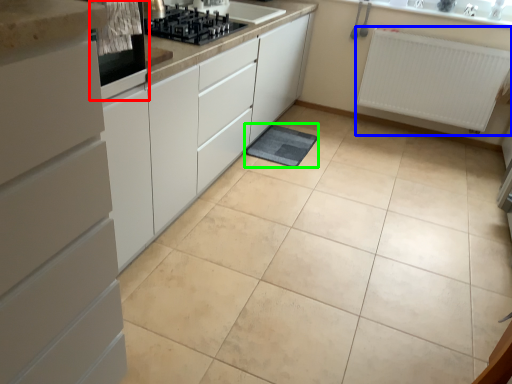
Question: Which object is the farthest from home appliance (highlighted by a red box)? Choose among these: radiator (highlighted by a blue box) or bath mat (highlighted by a green box).

Choices:
 (A) radiator
 (B) bath mat

Answer: (A)